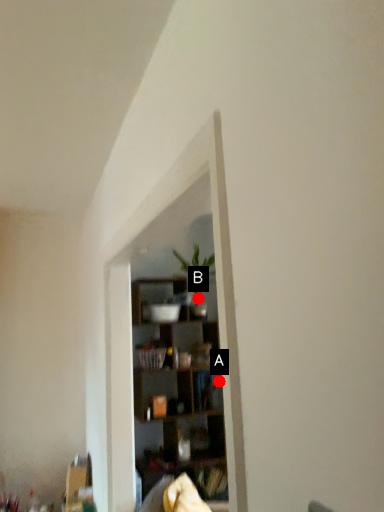
Question: Two points are circled on the image, labeled by A and B beside each circle. Which point appears farthest from the camera in this image?

Choices:
 (A) A is further
 (B) B is further

Answer: (B)